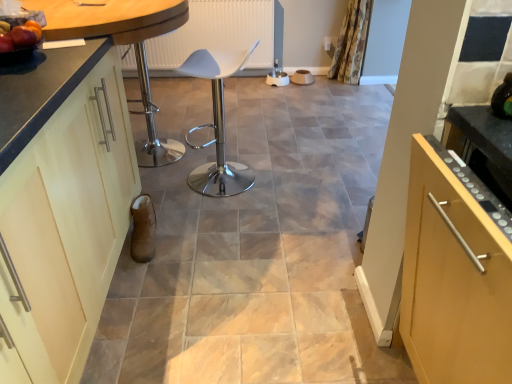
Question: Does white plastic chair at center appear on the right side of matte black countertop at left?

Choices:
 (A) no
 (B) yes

Answer: (B)

Question: From the image's perspective, is white plastic chair at center on top of matte black countertop at left?

Choices:
 (A) no
 (B) yes

Answer: (A)

Question: Can you confirm if white plastic chair at center is thinner than matte black countertop at left?

Choices:
 (A) no
 (B) yes

Answer: (B)

Question: Is matte black countertop at left at the back of white plastic chair at center?

Choices:
 (A) no
 (B) yes

Answer: (A)

Question: From a real-world perspective, is white plastic chair at center on top of matte black countertop at left?

Choices:
 (A) no
 (B) yes

Answer: (A)

Question: Visually, is white plastic chair at center positioned to the left or to the right of matte cream cabinet at left?

Choices:
 (A) right
 (B) left

Answer: (A)

Question: Is white plastic chair at center in front of or behind matte cream cabinet at left in the image?

Choices:
 (A) front
 (B) behind

Answer: (B)

Question: Considering the positions of white plastic chair at center and matte cream cabinet at left in the image, is white plastic chair at center taller or shorter than matte cream cabinet at left?

Choices:
 (A) tall
 (B) short

Answer: (B)

Question: In terms of width, does white plastic chair at center look wider or thinner when compared to matte cream cabinet at left?

Choices:
 (A) thin
 (B) wide

Answer: (A)

Question: Would you say white plastic chair at center is to the left or to the right of metallic silver bar stool at center in the picture?

Choices:
 (A) right
 (B) left

Answer: (A)

Question: From the image's perspective, is white plastic chair at center positioned above or below metallic silver bar stool at center?

Choices:
 (A) below
 (B) above

Answer: (A)

Question: Is white plastic chair at center bigger or smaller than metallic silver bar stool at center?

Choices:
 (A) big
 (B) small

Answer: (B)

Question: Is point [218, 170] positioned closer to the camera than point [131, 39]?

Choices:
 (A) closer
 (B) farther

Answer: (B)

Question: From a real-world perspective, is matte cream cabinet at left above or below white plastic chair at center?

Choices:
 (A) above
 (B) below

Answer: (A)

Question: Is point (27, 334) closer or farther from the camera than point (202, 71)?

Choices:
 (A) farther
 (B) closer

Answer: (B)